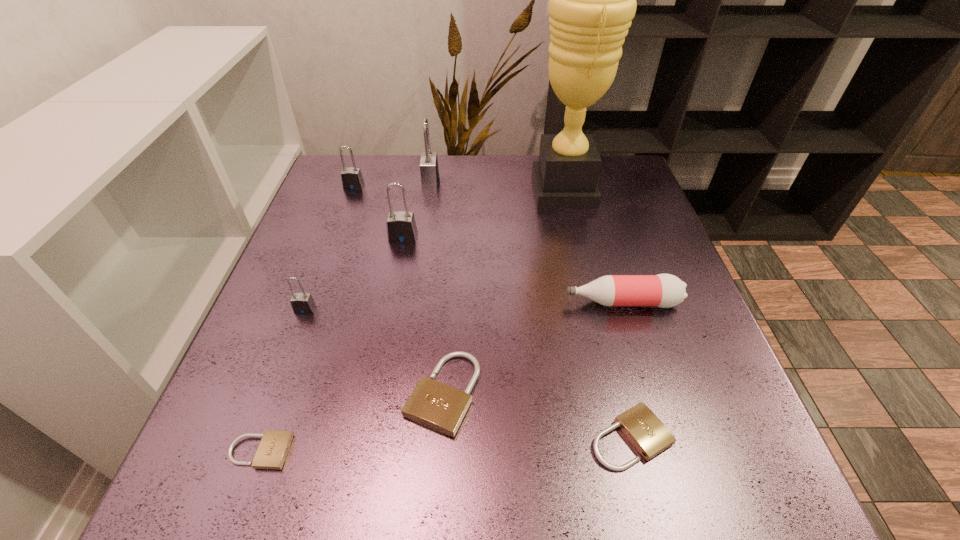
At what (x,y) coordinates should I click in order to perform the action: click on vacant space located at the front of the tallest object with handles. Please return your answer as a coordinate pair (x, y). The image size is (960, 540). Looking at the image, I should click on (399, 190).

You are a GUI agent. You are given a task and a screenshot of the screen. Output one action in this format:
    pyautogui.click(x=<x>, y=<y>)
    Task: Click on the free space located 0.120m on the shackle of the biggest gray padlock
    Image resolution: width=960 pixels, height=540 pixels.
    Given the screenshot: What is the action you would take?
    pyautogui.click(x=484, y=182)

This screenshot has width=960, height=540. Identify the location of vacant space located 0.330m on the shackle of the second nearest gray padlock. (x=379, y=364).

I want to click on vacant region located 0.200m on the shackle of the second smallest gray padlock, so click(335, 239).

Where is `vacant space located 0.240m on the shackle of the nearest gray padlock`? The width and height of the screenshot is (960, 540). vacant space located 0.240m on the shackle of the nearest gray padlock is located at coordinates [260, 430].

The width and height of the screenshot is (960, 540). In order to click on free space located with the cap open on the bottle in this screenshot , I will do `click(455, 302)`.

Locate an element on the screen. This screenshot has height=540, width=960. vacant area situated 0.050m with the cap open on the bottle is located at coordinates (540, 302).

I want to click on vacant space located 0.080m with the cap open on the bottle, so click(525, 302).

Find the location of a particular element. free spot located on the right of the second beige padlock from left to right is located at coordinates coord(611,393).

Locate an element on the screen. Image resolution: width=960 pixels, height=540 pixels. vacant space located 0.090m on the left of the rightmost beige padlock is located at coordinates (533, 437).